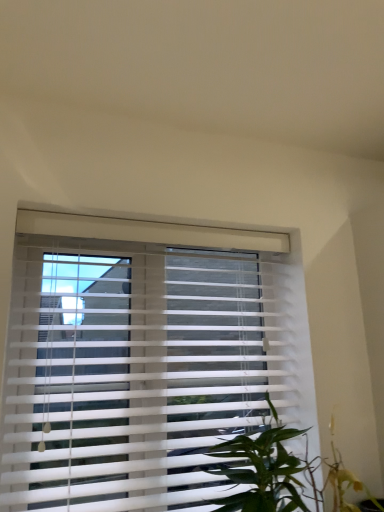
Question: Is white plastic blinds at center taller than green leafy plant at lower right?

Choices:
 (A) yes
 (B) no

Answer: (A)

Question: Is white plastic blinds at center to the right of green leafy plant at lower right from the viewer's perspective?

Choices:
 (A) yes
 (B) no

Answer: (B)

Question: Could you tell me if white plastic blinds at center is turned towards green leafy plant at lower right?

Choices:
 (A) yes
 (B) no

Answer: (A)

Question: From a real-world perspective, is white plastic blinds at center physically below green leafy plant at lower right?

Choices:
 (A) no
 (B) yes

Answer: (A)

Question: Can you confirm if white plastic blinds at center is bigger than green leafy plant at lower right?

Choices:
 (A) no
 (B) yes

Answer: (B)

Question: Does white plastic blinds at center have a greater width compared to green leafy plant at lower right?

Choices:
 (A) yes
 (B) no

Answer: (B)

Question: From a real-world perspective, is green leafy plant at lower right physically above white plastic blinds at center?

Choices:
 (A) no
 (B) yes

Answer: (A)

Question: From a real-world perspective, is green leafy plant at lower right located beneath white plastic blinds at center?

Choices:
 (A) yes
 (B) no

Answer: (A)

Question: Does green leafy plant at lower right have a greater height compared to white plastic blinds at center?

Choices:
 (A) yes
 (B) no

Answer: (B)

Question: Is green leafy plant at lower right oriented away from white plastic blinds at center?

Choices:
 (A) yes
 (B) no

Answer: (A)

Question: Is green leafy plant at lower right smaller than white plastic blinds at center?

Choices:
 (A) yes
 (B) no

Answer: (A)

Question: Is green leafy plant at lower right bigger than white plastic blinds at center?

Choices:
 (A) no
 (B) yes

Answer: (A)

Question: Is green leafy plant at lower right bigger or smaller than white plastic blinds at center?

Choices:
 (A) small
 (B) big

Answer: (A)